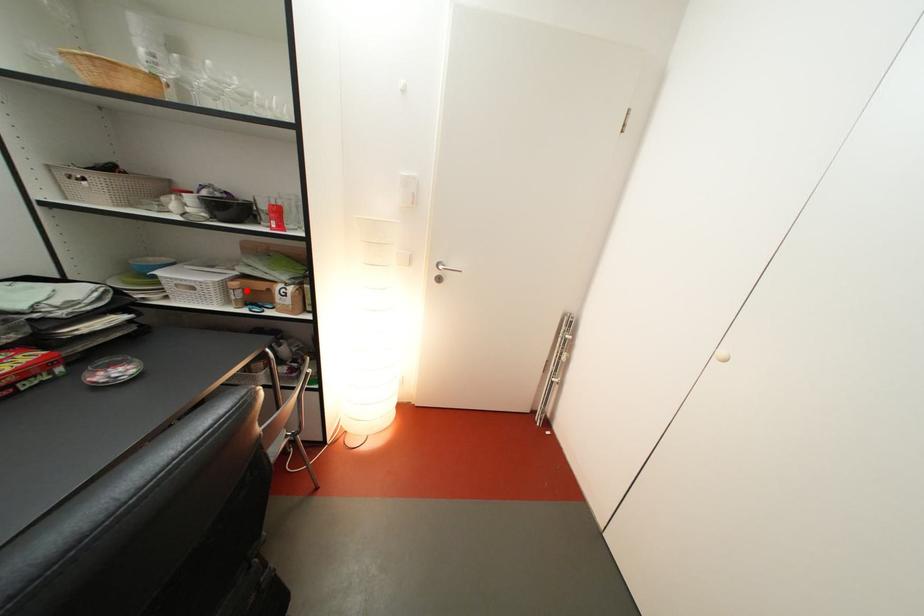
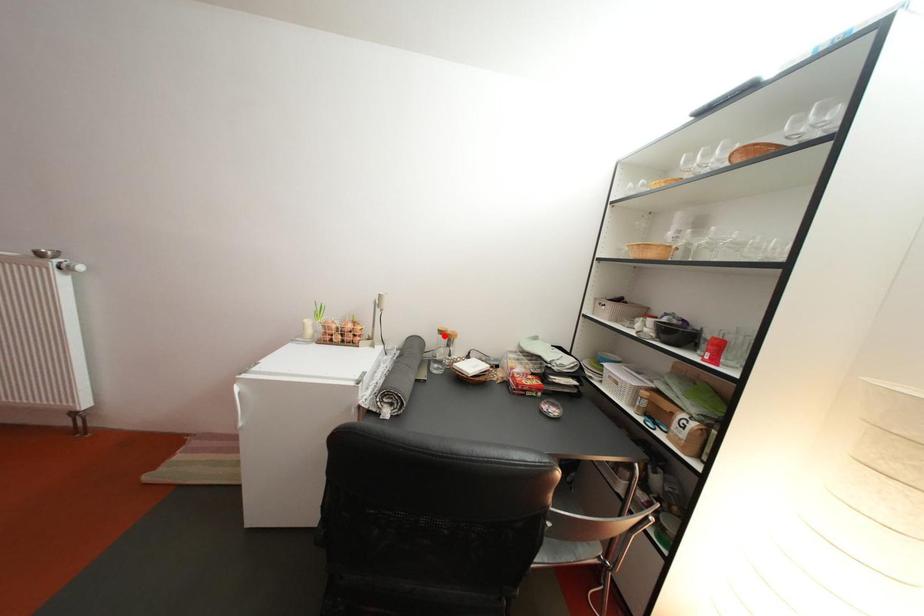
I am providing you with two images of the same scene from different viewpoints. A red point is marked on the first image and another point is marked on the second image. Is the red point in image1 aligned with the point shown in image2?

No